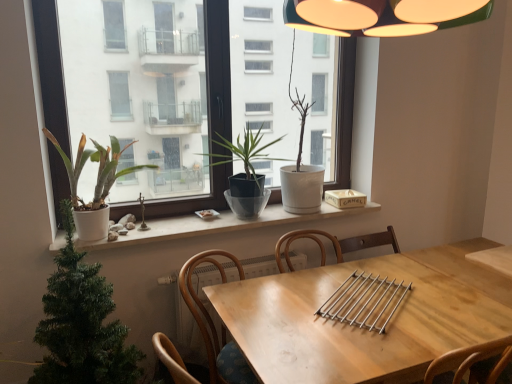
Question: Is white matte window sill at center bigger than white matte pot at left, the first houseplant viewed from the left?

Choices:
 (A) no
 (B) yes

Answer: (A)

Question: Can we say white matte window sill at center lies outside white matte pot at left, marked as the fourth houseplant in a right-to-left arrangement?

Choices:
 (A) no
 (B) yes

Answer: (B)

Question: Can you confirm if white matte window sill at center is positioned to the right of white matte pot at left, the first houseplant viewed from the left?

Choices:
 (A) no
 (B) yes

Answer: (B)

Question: From the image's perspective, is white matte window sill at center over white matte pot at left, marked as the fourth houseplant in a right-to-left arrangement?

Choices:
 (A) yes
 (B) no

Answer: (B)

Question: From a real-world perspective, does white matte window sill at center sit lower than white matte pot at left, marked as the fourth houseplant in a right-to-left arrangement?

Choices:
 (A) yes
 (B) no

Answer: (A)

Question: In the image, is wooden at center positioned in front of or behind white matte pot at left, marked as the fourth houseplant in a right-to-left arrangement?

Choices:
 (A) front
 (B) behind

Answer: (A)

Question: Considering the positions of point (222, 251) and point (81, 148), is point (222, 251) closer or farther from the camera than point (81, 148)?

Choices:
 (A) farther
 (B) closer

Answer: (A)

Question: Considering the positions of wooden at center and white matte pot at left, marked as the fourth houseplant in a right-to-left arrangement, in the image, is wooden at center taller or shorter than white matte pot at left, marked as the fourth houseplant in a right-to-left arrangement,?

Choices:
 (A) tall
 (B) short

Answer: (A)

Question: In terms of size, does wooden at center appear bigger or smaller than white matte pot at left, marked as the fourth houseplant in a right-to-left arrangement?

Choices:
 (A) big
 (B) small

Answer: (A)

Question: Do you think matte gray pot at center, which is the 2th houseplant in right-to-left order, is within matte white window at center, or outside of it?

Choices:
 (A) inside
 (B) outside

Answer: (B)

Question: Is matte gray pot at center, which is the 2th houseplant in right-to-left order, in front of or behind matte white window at center in the image?

Choices:
 (A) behind
 (B) front

Answer: (A)

Question: In terms of height, does matte gray pot at center, which is the 2th houseplant in right-to-left order, look taller or shorter compared to matte white window at center?

Choices:
 (A) tall
 (B) short

Answer: (B)

Question: In terms of width, does matte gray pot at center, which is the 2th houseplant in right-to-left order, look wider or thinner when compared to matte white window at center?

Choices:
 (A) thin
 (B) wide

Answer: (B)

Question: Considering their positions, is matte white window at center located in front of or behind green matte christmas tree at lower left, acting as the third houseplant starting from the right?

Choices:
 (A) front
 (B) behind

Answer: (B)

Question: Visually, is matte white window at center positioned to the left or to the right of green matte christmas tree at lower left, the second houseplant from the left?

Choices:
 (A) right
 (B) left

Answer: (A)